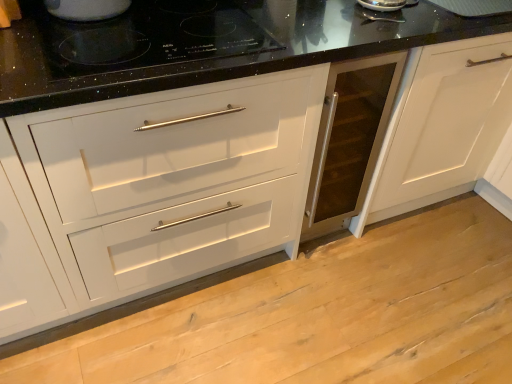
Where is `white glossy kettle at upper left`? This screenshot has width=512, height=384. white glossy kettle at upper left is located at coordinates (86, 9).

The height and width of the screenshot is (384, 512). What do you see at coordinates (86, 9) in the screenshot?
I see `white glossy kettle at upper left` at bounding box center [86, 9].

Image resolution: width=512 pixels, height=384 pixels. Describe the element at coordinates (149, 40) in the screenshot. I see `black glass cooktop at upper center` at that location.

Locate an element on the screen. This screenshot has height=384, width=512. black glass cooktop at upper center is located at coordinates (149, 40).

Where is `white glossy kettle at upper left`? This screenshot has height=384, width=512. white glossy kettle at upper left is located at coordinates (86, 9).

Visually, is black glass cooktop at upper center positioned to the left or to the right of white glossy kettle at upper left?

black glass cooktop at upper center is positioned on white glossy kettle at upper left's right side.

Who is more distant, black glass cooktop at upper center or white glossy kettle at upper left?

white glossy kettle at upper left is more distant.

Which point is more distant from viewer, [196,19] or [95,18]?

Point [196,19]

From the image's perspective, which is below, black glass cooktop at upper center or white glossy kettle at upper left?

black glass cooktop at upper center is shown below in the image.

Based on the photo, from a real-world perspective, between black glass cooktop at upper center and white glossy kettle at upper left, who is vertically lower?

black glass cooktop at upper center, from a real-world perspective.

Consider the image. Is black glass cooktop at upper center thinner than white glossy kettle at upper left?

No.

Considering the relative sizes of black glass cooktop at upper center and white glossy kettle at upper left in the image provided, is black glass cooktop at upper center shorter than white glossy kettle at upper left?

Yes, black glass cooktop at upper center is shorter than white glossy kettle at upper left.

Who is smaller, black glass cooktop at upper center or white glossy kettle at upper left?

With smaller size is white glossy kettle at upper left.

Is black glass cooktop at upper center situated inside white glossy kettle at upper left or outside?

black glass cooktop at upper center cannot be found inside white glossy kettle at upper left.

Is black glass cooktop at upper center next to white glossy kettle at upper left and touching it?

No, black glass cooktop at upper center is not touching white glossy kettle at upper left.

Does black glass cooktop at upper center turn towards white glossy kettle at upper left?

No.

How different are the orientations of black glass cooktop at upper center and white glossy kettle at upper left in degrees?

0.502 degrees separate the facing orientations of black glass cooktop at upper center and white glossy kettle at upper left.

How far apart are black glass cooktop at upper center and white glossy kettle at upper left?

black glass cooktop at upper center and white glossy kettle at upper left are 8.62 inches apart from each other.

Identify the location of appliance behind the black glass cooktop at upper center. (86, 9).

Would you say white glossy kettle at upper left is to the left or to the right of black glass cooktop at upper center in the picture?

From the image, it's evident that white glossy kettle at upper left is to the left of black glass cooktop at upper center.

Considering the positions of objects white glossy kettle at upper left and black glass cooktop at upper center in the image provided, who is behind, white glossy kettle at upper left or black glass cooktop at upper center?

white glossy kettle at upper left is behind.

Considering the positions of points (85, 5) and (225, 10), is point (85, 5) farther from camera compared to point (225, 10)?

No, (85, 5) is in front of (225, 10).

From the image's perspective, is white glossy kettle at upper left located above black glass cooktop at upper center?

Yes, from the image's perspective, white glossy kettle at upper left is over black glass cooktop at upper center.

From a real-world perspective, is white glossy kettle at upper left on black glass cooktop at upper center?

Indeed, from a real-world perspective, white glossy kettle at upper left stands above black glass cooktop at upper center.

Which of these two, white glossy kettle at upper left or black glass cooktop at upper center, is wider?

black glass cooktop at upper center.

Between white glossy kettle at upper left and black glass cooktop at upper center, which one has less height?

Answer: black glass cooktop at upper center.

In the scene shown: Who is bigger, white glossy kettle at upper left or black glass cooktop at upper center?

Bigger between the two is black glass cooktop at upper center.

Which is correct: white glossy kettle at upper left is inside black glass cooktop at upper center, or outside of it?

white glossy kettle at upper left is spatially situated outside black glass cooktop at upper center.

Is there a large distance between white glossy kettle at upper left and black glass cooktop at upper center?

No, white glossy kettle at upper left is in close proximity to black glass cooktop at upper center.

Is white glossy kettle at upper left positioned with its back to black glass cooktop at upper center?

No, black glass cooktop at upper center is not at the back of white glossy kettle at upper left.

Can you tell me how much white glossy kettle at upper left and black glass cooktop at upper center differ in facing direction?

There is a 0.502-degree angle between the facing directions of white glossy kettle at upper left and black glass cooktop at upper center.

How much distance is there between white glossy kettle at upper left and black glass cooktop at upper center?

white glossy kettle at upper left and black glass cooktop at upper center are 21.91 centimeters apart from each other.

The width and height of the screenshot is (512, 384). What are the coordinates of `appliance above the black glass cooktop at upper center (from a real-world perspective)` in the screenshot? It's located at pyautogui.click(x=86, y=9).

Find the location of `appliance lying behind the black glass cooktop at upper center`. appliance lying behind the black glass cooktop at upper center is located at coordinates (86, 9).

Identify the location of gas stove to the right of white glossy kettle at upper left. The image size is (512, 384). (149, 40).